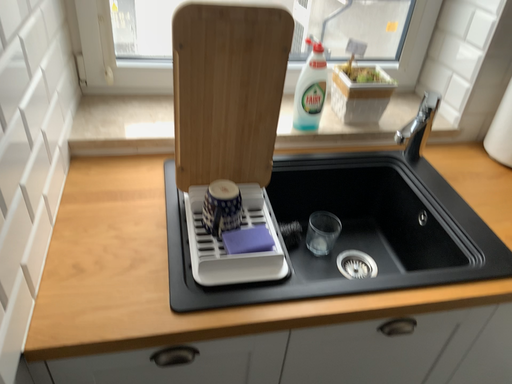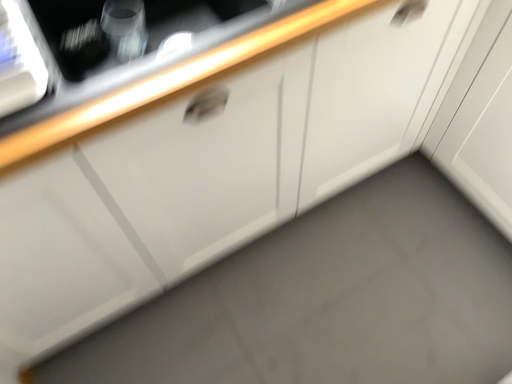
Question: How did the camera likely rotate when shooting the video?

Choices:
 (A) rotated downward
 (B) rotated upward

Answer: (A)